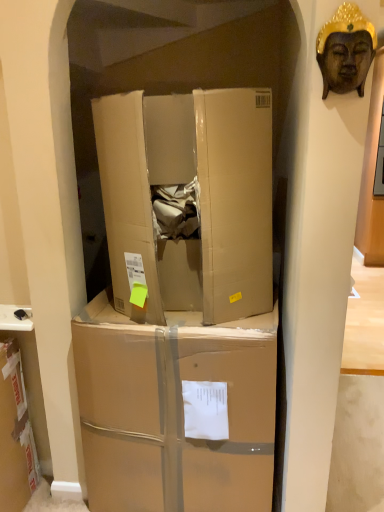
Question: Would you say brown cardboard box at center, arranged as the first box when ordered from the bottom, is inside or outside wooden buddha head at upper right?

Choices:
 (A) outside
 (B) inside

Answer: (A)

Question: Considering their positions, is brown cardboard box at center, arranged as the first box when ordered from the bottom, located in front of or behind wooden buddha head at upper right?

Choices:
 (A) front
 (B) behind

Answer: (B)

Question: Which of these objects is positioned farthest from the wooden buddha head at upper right?

Choices:
 (A) cardboard box at center, which is counted as the second box, starting from the bottom
 (B) brown cardboard box at center, arranged as the first box when ordered from the bottom

Answer: (B)

Question: Estimate the real-world distances between objects in this image. Which object is closer to the brown cardboard box at center, arranged as the first box when ordered from the bottom?

Choices:
 (A) wooden buddha head at upper right
 (B) cardboard box at center, the 1th box in the top-to-bottom sequence

Answer: (B)